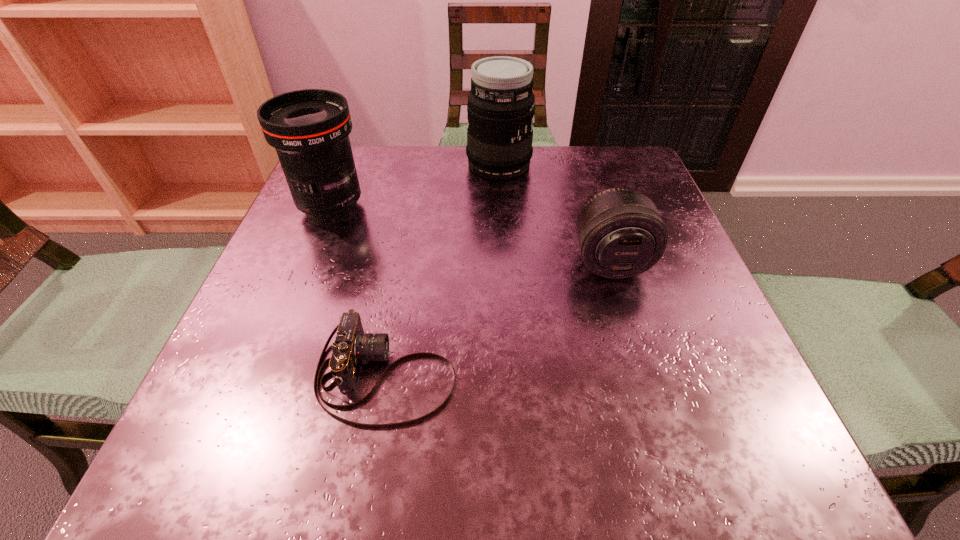
Locate an element on the screen. Image resolution: width=960 pixels, height=540 pixels. vacant space at the left edge of the desktop is located at coordinates (276, 365).

I want to click on vacant space at the right edge of the desktop, so tap(686, 312).

Identify the location of blank space at the far left corner of the desktop. (370, 157).

Find the location of `vacant space at the near left corner of the desktop`. vacant space at the near left corner of the desktop is located at coordinates (294, 429).

Find the location of a particular element. The height and width of the screenshot is (540, 960). vacant space at the far right corner of the desktop is located at coordinates (580, 173).

You are a GUI agent. You are given a task and a screenshot of the screen. Output one action in this format:
    pyautogui.click(x=<x>, y=<y>)
    Task: Click on the free area in between the third object from left to right and the second nearest telephoto lens
    
    Given the screenshot: What is the action you would take?
    pyautogui.click(x=415, y=186)

You are a GUI agent. You are given a task and a screenshot of the screen. Output one action in this format:
    pyautogui.click(x=<x>, y=<y>)
    Task: Click on the free space between the farthest object and the leftmost telephoto lens
    The image size is (960, 540).
    Given the screenshot: What is the action you would take?
    pyautogui.click(x=415, y=186)

Where is `blank region between the third nearest object and the nearest object`? This screenshot has height=540, width=960. blank region between the third nearest object and the nearest object is located at coordinates (359, 291).

This screenshot has height=540, width=960. What are the coordinates of `unoccupied position between the shortest object and the second nearest telephoto lens` in the screenshot? It's located at (359, 291).

In order to click on free spot between the second nearest telephoto lens and the third farthest object in this screenshot , I will do `click(470, 234)`.